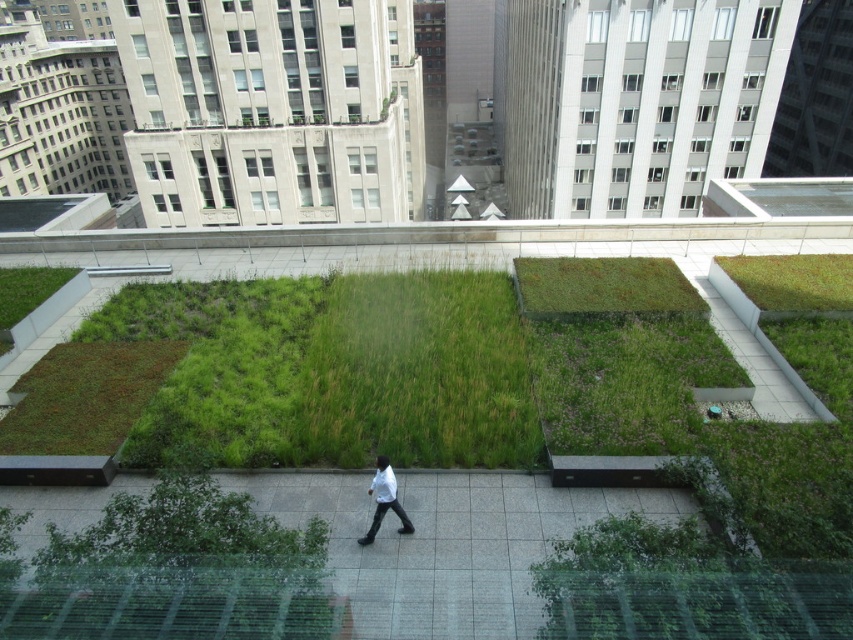
Question: Which point is farther from the camera taking this photo?

Choices:
 (A) coord(845,291)
 (B) coord(622,300)

Answer: (A)

Question: Is green mossy patch at center-right positioned behind green grass at upper right?

Choices:
 (A) no
 (B) yes

Answer: (A)

Question: Can you confirm if green mossy patch at center-right is bigger than green grass at upper right?

Choices:
 (A) no
 (B) yes

Answer: (B)

Question: Based on their relative distances, which object is nearer to the green mossy patch at center-right?

Choices:
 (A) white matte shirt at center
 (B) green grass at upper right

Answer: (B)

Question: Is green mossy patch at center-right bigger than green grass at upper right?

Choices:
 (A) no
 (B) yes

Answer: (B)

Question: Based on their relative distances, which object is nearer to the white matte shirt at center?

Choices:
 (A) green grass at upper right
 (B) green mossy patch at center-right

Answer: (B)